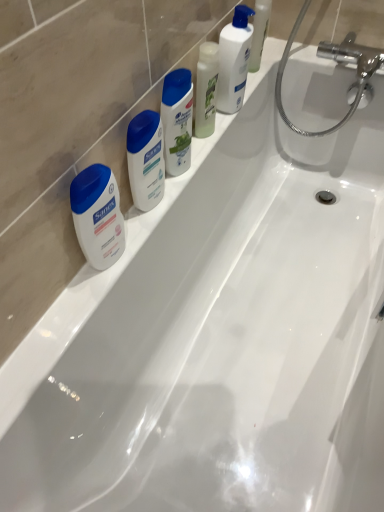
What are the coordinates of `free space in front of white matte sanex soap at left, the 1th toiletry when ordered from left to right` in the screenshot? It's located at (67, 318).